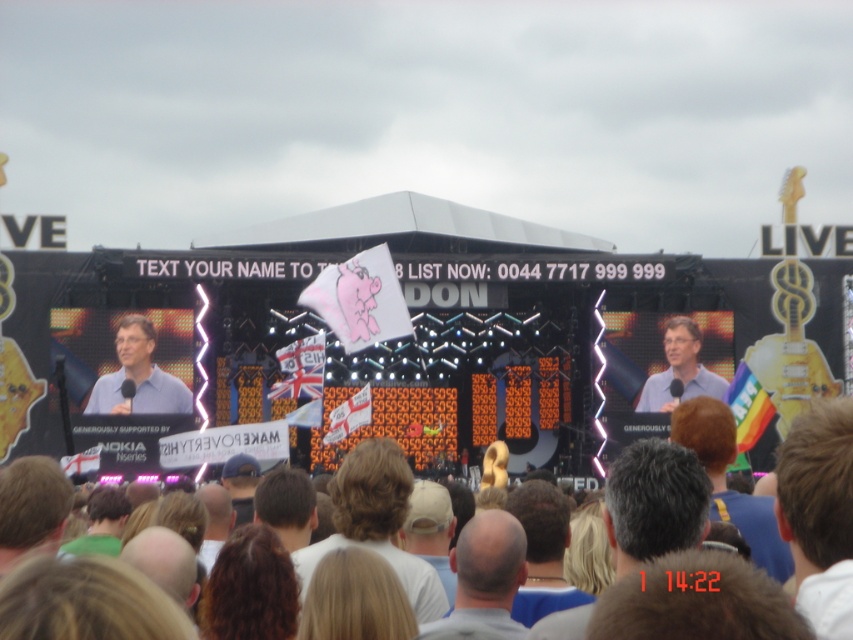
Question: Is matte blue shirt at left bigger than light blue shirt at center?

Choices:
 (A) no
 (B) yes

Answer: (A)

Question: Which object appears farthest from the camera in this image?

Choices:
 (A) bald head at center
 (B) light blue shirt at center

Answer: (B)

Question: Does bald head at center have a larger size compared to matte blue shirt at left?

Choices:
 (A) no
 (B) yes

Answer: (B)

Question: Which of these objects is positioned farthest from the matte blue shirt at left?

Choices:
 (A) bald head at center
 (B) light blue shirt at center

Answer: (B)

Question: Is the position of bald head at center less distant than that of matte blue shirt at left?

Choices:
 (A) no
 (B) yes

Answer: (B)

Question: Considering the real-world distances, which object is farthest from the matte blue shirt at left?

Choices:
 (A) bald head at center
 (B) light blue shirt at center

Answer: (B)